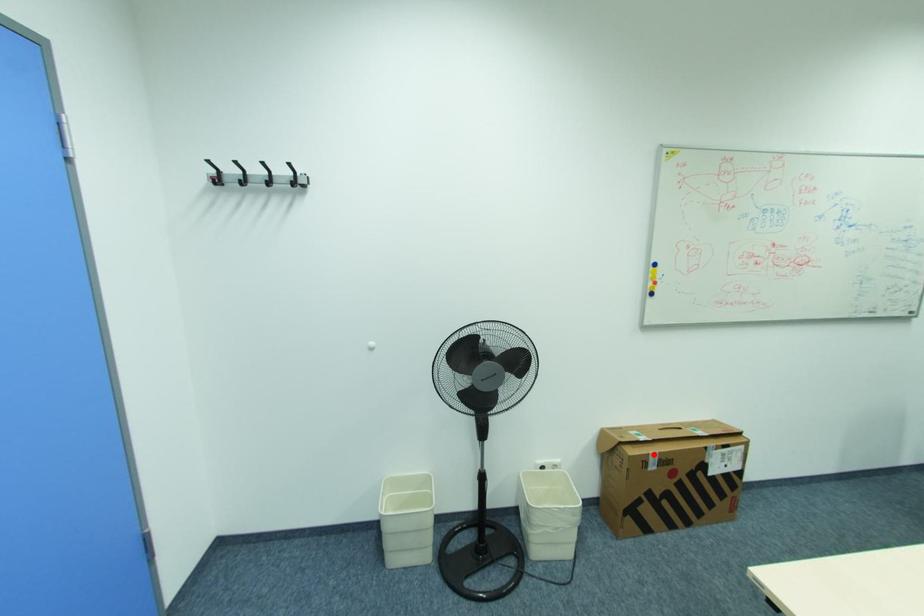
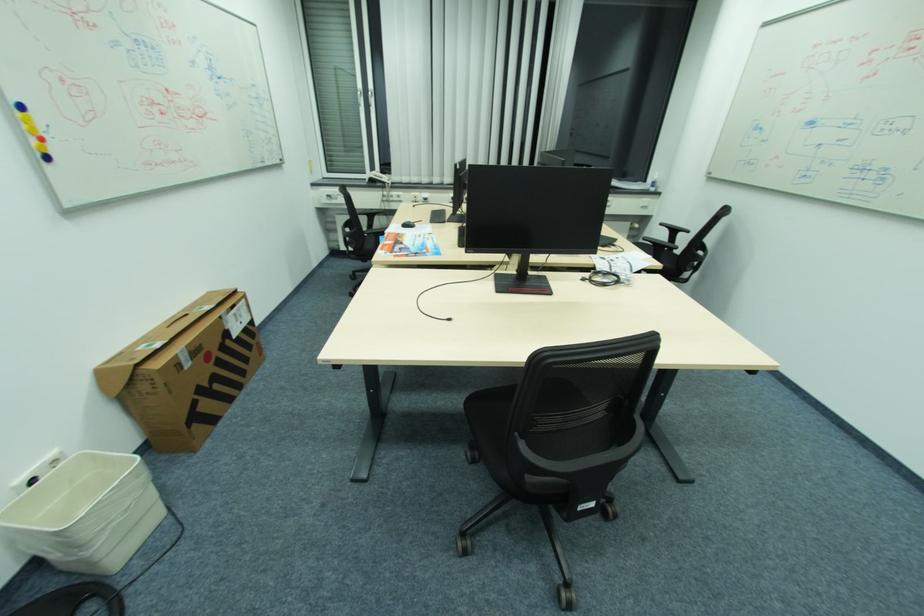
In the second image, find the point that corresponds to the highlighted location in the first image.

(181, 355)